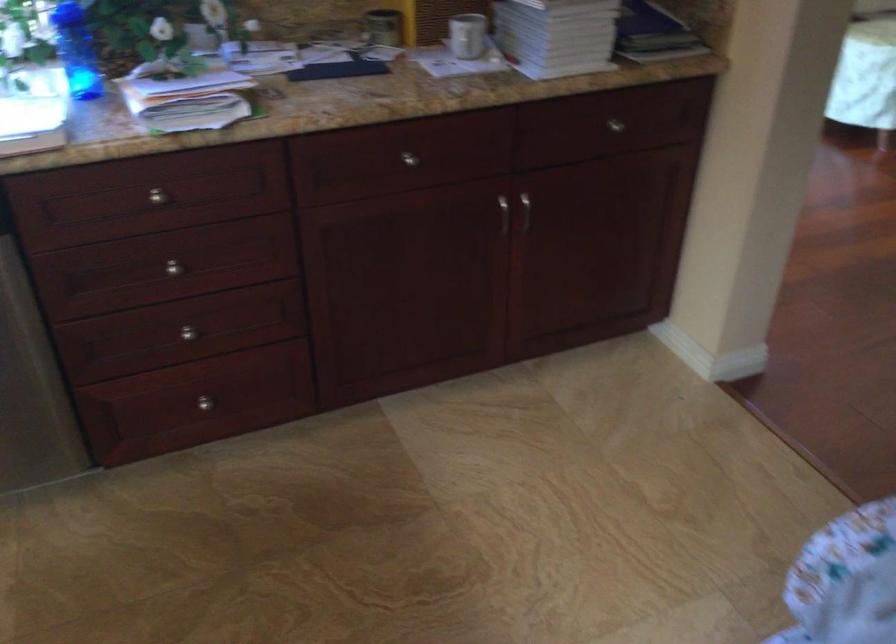
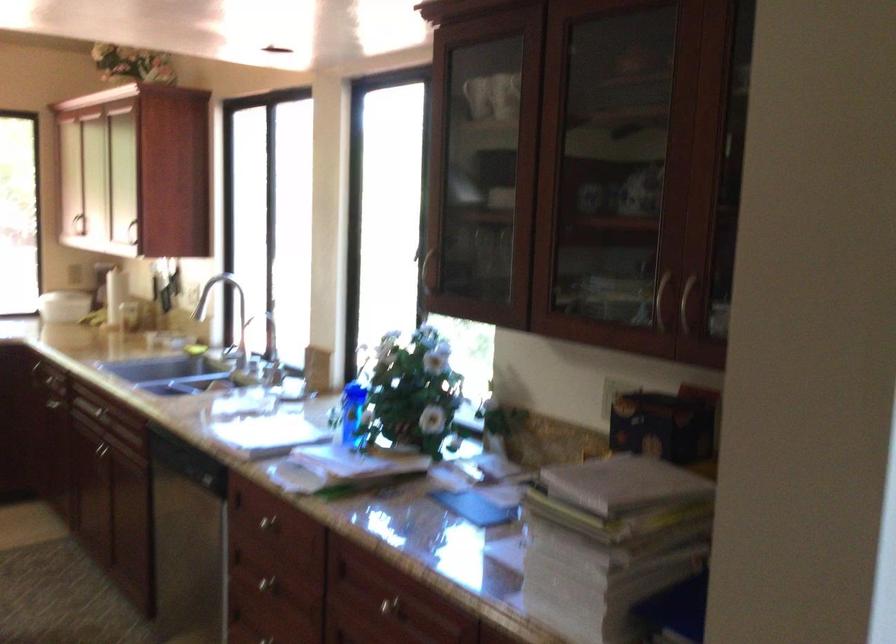
Find the pixel in the second image that matches (159,196) in the first image.

(266, 522)